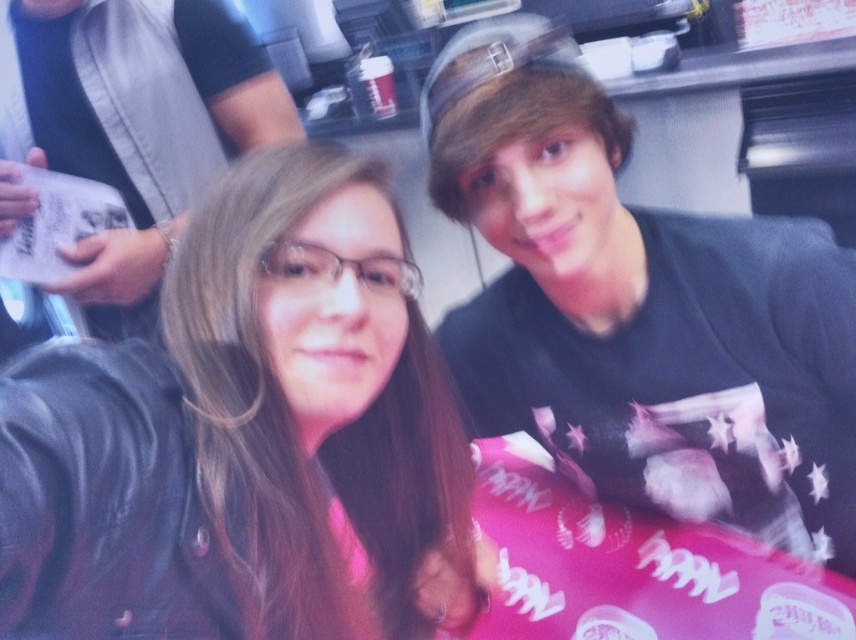
Is matte black jacket at center taller than matte black hair at left?

No, matte black jacket at center is not taller than matte black hair at left.

Which is above, matte black jacket at center or matte black hair at left?

matte black hair at left

Image resolution: width=856 pixels, height=640 pixels. I want to click on matte black jacket at center, so click(248, 436).

Does black matte shirt at upper right have a greater width compared to matte black hair at left?

Yes, black matte shirt at upper right is wider than matte black hair at left.

In order to click on black matte shirt at upper right in this screenshot , I will do `click(639, 308)`.

The height and width of the screenshot is (640, 856). What do you see at coordinates (639, 308) in the screenshot?
I see `black matte shirt at upper right` at bounding box center [639, 308].

Identify the location of black matte shirt at upper right. (639, 308).

Can you confirm if matte black jacket at center is taller than black matte shirt at upper right?

No.

Does matte black jacket at center appear under black matte shirt at upper right?

Indeed, matte black jacket at center is positioned under black matte shirt at upper right.

Describe the element at coordinates (248, 436) in the screenshot. I see `matte black jacket at center` at that location.

You are a GUI agent. You are given a task and a screenshot of the screen. Output one action in this format:
    pyautogui.click(x=<x>, y=<y>)
    Task: Click on the matte black jacket at center
    The image size is (856, 640).
    Given the screenshot: What is the action you would take?
    pyautogui.click(x=248, y=436)